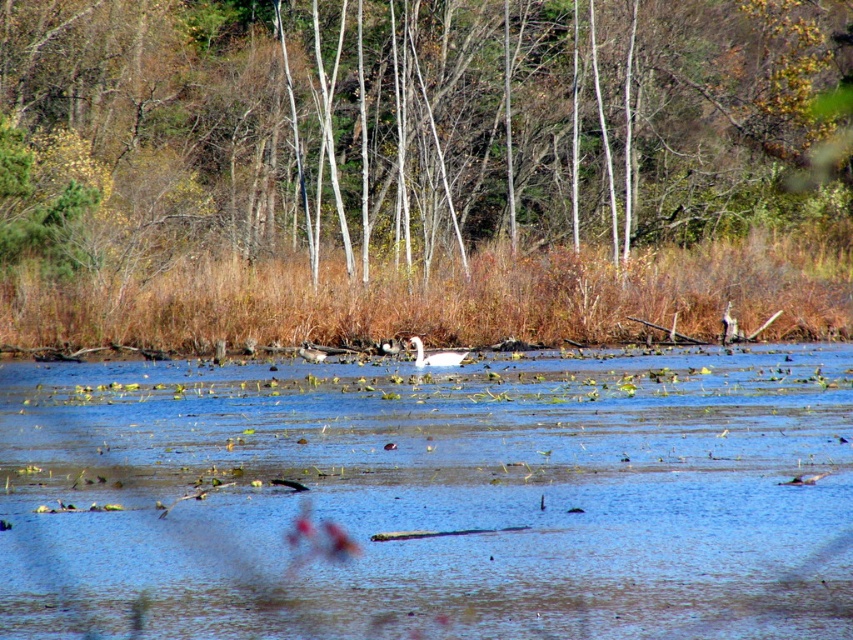
Measure the distance between point (515, 476) and camera.

They are 19.59 meters apart.

Does clear blue water at center have a smaller size compared to brown bark trees at upper center?

Correct, clear blue water at center occupies less space than brown bark trees at upper center.

Between point (778, 545) and point (612, 161), which one is positioned behind?

Positioned behind is point (612, 161).

Identify the location of clear blue water at center. (433, 497).

Between brown bark trees at upper center and white glossy swan at center, which one has less height?

With less height is white glossy swan at center.

In the scene shown: Who is higher up, brown bark trees at upper center or white glossy swan at center?

Positioned higher is brown bark trees at upper center.

Where is `brown bark trees at upper center`? The image size is (853, 640). brown bark trees at upper center is located at coordinates (434, 120).

Which of these two, clear blue water at center or white glossy swan at center, stands taller?

clear blue water at center is taller.

Which is behind, point (747, 356) or point (415, 337)?

Positioned behind is point (415, 337).

Which is behind, point (831, 406) or point (460, 360)?

Point (460, 360)

Locate an element on the screen. clear blue water at center is located at coordinates (433, 497).